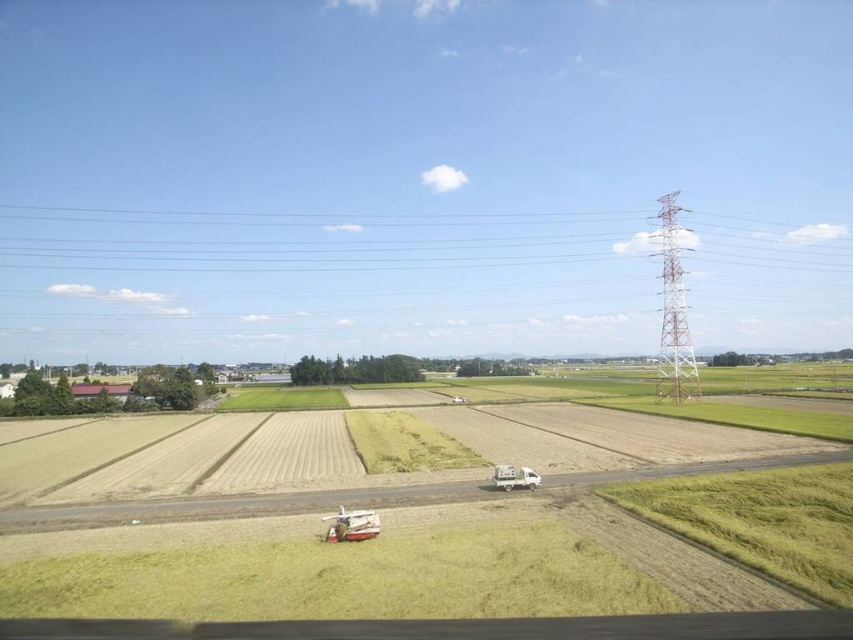
You are standing in the rural landscape and want to take a photo of the green grassy field at center and the smooth wire power line at upper center. Which object will appear larger in your photo?

The green grassy field at center will appear larger in the photo because it is closer to the viewer than the smooth wire power line at upper center.

Looking at the rural landscape, where is the green grassy field at center in relation to the smooth wire power line at upper center?

The green grassy field at center is located to the right of the smooth wire power line at upper center.